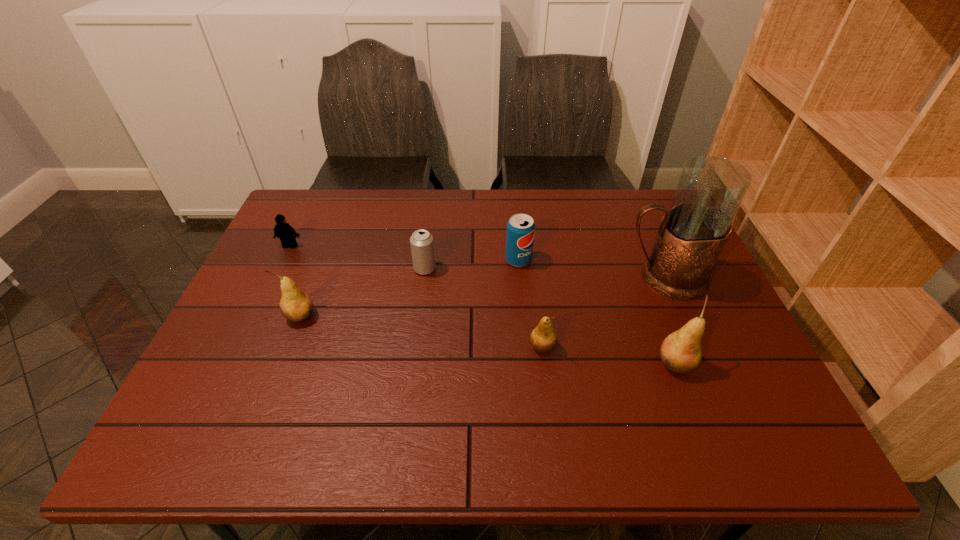
Locate an element on the screen. Image resolution: width=960 pixels, height=540 pixels. free space for an extra pear to achieve even spacing is located at coordinates (418, 331).